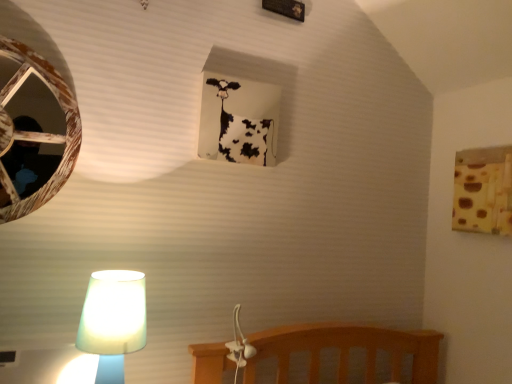
Locate an element on the screen. white paper at upper center, positioned as the 1th window frame in top-to-bottom order is located at coordinates (247, 99).

What do you see at coordinates (113, 321) in the screenshot? The image size is (512, 384). I see `translucent glass lamp at lower left` at bounding box center [113, 321].

I want to click on wooden birdhouse at left, so click(x=33, y=130).

At what (x,y) coordinates should I click in order to perform the action: click on brown textured fabric at upper right, the first window frame positioned from the bottom. Please return your answer as a coordinate pair (x, y). Image resolution: width=512 pixels, height=384 pixels. Looking at the image, I should click on (483, 190).

This screenshot has width=512, height=384. Find the location of `white paper at upper center, the first window frame positioned from the left`. white paper at upper center, the first window frame positioned from the left is located at coordinates pos(247,99).

Is translucent glass lamp at lower left touching wooden birdhouse at left?

translucent glass lamp at lower left is not next to wooden birdhouse at left, and they're not touching.

Can you tell me how much translucent glass lamp at lower left and wooden birdhouse at left differ in facing direction?

The angle between the facing direction of translucent glass lamp at lower left and the facing direction of wooden birdhouse at left is 2.9 degrees.

Would you say translucent glass lamp at lower left is to the left or to the right of wooden birdhouse at left in the picture?

Clearly, translucent glass lamp at lower left is on the right of wooden birdhouse at left in the image.

Is translucent glass lamp at lower left taller or shorter than wooden birdhouse at left?

Considering their sizes, translucent glass lamp at lower left has less height than wooden birdhouse at left.

Considering the points (121, 315) and (268, 103), which point is behind, point (121, 315) or point (268, 103)?

Positioned behind is point (268, 103).

Could you tell me if translucent glass lamp at lower left is turned towards white paper at upper center, the second window frame from the bottom?

No, translucent glass lamp at lower left is not oriented towards white paper at upper center, the second window frame from the bottom.

From the image's perspective, between translucent glass lamp at lower left and white paper at upper center, the first window frame positioned from the left, which one is located above?

white paper at upper center, the first window frame positioned from the left, is shown above in the image.

Would you say translucent glass lamp at lower left is outside white paper at upper center, the first window frame positioned from the left?

Yes, translucent glass lamp at lower left is outside of white paper at upper center, the first window frame positioned from the left.

Considering the positions of objects translucent glass lamp at lower left and brown textured fabric at upper right, which ranks as the 2th window frame in top-to-bottom order, in the image provided, who is more to the right, translucent glass lamp at lower left or brown textured fabric at upper right, which ranks as the 2th window frame in top-to-bottom order,?

Positioned to the right is brown textured fabric at upper right, which ranks as the 2th window frame in top-to-bottom order.

Is translucent glass lamp at lower left inside or outside of brown textured fabric at upper right, the first window frame positioned from the bottom?

translucent glass lamp at lower left lies outside brown textured fabric at upper right, the first window frame positioned from the bottom.

From a real-world perspective, is translucent glass lamp at lower left positioned above or below brown textured fabric at upper right, the 2th window frame from the left?

From a real-world perspective, translucent glass lamp at lower left is physically below brown textured fabric at upper right, the 2th window frame from the left.

Identify the location of lamp that appears below the brown textured fabric at upper right, the 2th window frame from the left (from the image's perspective). The height and width of the screenshot is (384, 512). (113, 321).

Is wooden birdhouse at left bigger or smaller than white paper at upper center, the second window frame from the right?

wooden birdhouse at left is bigger than white paper at upper center, the second window frame from the right.

Does wooden birdhouse at left appear on the right side of white paper at upper center, positioned as the 1th window frame in top-to-bottom order?

No.

Does point (12, 192) come in front of point (237, 61)?

That is True.

Can you confirm if brown textured fabric at upper right, which ranks as the 2th window frame in top-to-bottom order, is wider than white paper at upper center, positioned as the 1th window frame in top-to-bottom order?

In fact, brown textured fabric at upper right, which ranks as the 2th window frame in top-to-bottom order, might be narrower than white paper at upper center, positioned as the 1th window frame in top-to-bottom order.

Is brown textured fabric at upper right, the 2th window frame from the left, positioned beyond the bounds of white paper at upper center, the second window frame from the right?

Absolutely, brown textured fabric at upper right, the 2th window frame from the left, is external to white paper at upper center, the second window frame from the right.

Which is more to the right, brown textured fabric at upper right, the first window frame positioned from the bottom, or white paper at upper center, the second window frame from the right?

Positioned to the right is brown textured fabric at upper right, the first window frame positioned from the bottom.

Is brown textured fabric at upper right, which ranks as the 2th window frame in top-to-bottom order, aimed at white paper at upper center, the second window frame from the right?

Yes, brown textured fabric at upper right, which ranks as the 2th window frame in top-to-bottom order, is aimed at white paper at upper center, the second window frame from the right.

Which object is further away from the camera taking this photo, wooden birdhouse at left or translucent glass lamp at lower left?

wooden birdhouse at left is more distant.

The width and height of the screenshot is (512, 384). In order to click on oval on the left of translucent glass lamp at lower left in this screenshot , I will do `click(33, 130)`.

Is wooden birdhouse at left bigger than translucent glass lamp at lower left?

Correct, wooden birdhouse at left is larger in size than translucent glass lamp at lower left.

From a real-world perspective, is wooden birdhouse at left above or below translucent glass lamp at lower left?

From a real-world perspective, wooden birdhouse at left is physically above translucent glass lamp at lower left.

What's the angular difference between white paper at upper center, the second window frame from the bottom, and wooden birdhouse at left's facing directions?

They differ by 0.00488 degrees in their facing directions.

Who is more distant, white paper at upper center, the second window frame from the bottom, or wooden birdhouse at left?

white paper at upper center, the second window frame from the bottom.

From the image's perspective, who appears lower, white paper at upper center, the second window frame from the bottom, or wooden birdhouse at left?

From the image's view, wooden birdhouse at left is below.

Based on the photo, is white paper at upper center, the second window frame from the right, looking in the opposite direction of wooden birdhouse at left?

No, wooden birdhouse at left is not at the back of white paper at upper center, the second window frame from the right.

Locate an element on the screen. oval behind the translucent glass lamp at lower left is located at coordinates (33, 130).

Where is `lamp below the white paper at upper center, the first window frame positioned from the left (from the image's perspective)`? The height and width of the screenshot is (384, 512). lamp below the white paper at upper center, the first window frame positioned from the left (from the image's perspective) is located at coordinates click(113, 321).

Estimate the real-world distances between objects in this image. Which object is further from wooden birdhouse at left, brown textured fabric at upper right, which ranks as the 2th window frame in top-to-bottom order, or translucent glass lamp at lower left?

brown textured fabric at upper right, which ranks as the 2th window frame in top-to-bottom order, is further to wooden birdhouse at left.

Which object lies nearer to the anchor point translucent glass lamp at lower left, brown textured fabric at upper right, the 2th window frame from the left, or wooden birdhouse at left?

wooden birdhouse at left lies closer to translucent glass lamp at lower left than the other object.

Estimate the real-world distances between objects in this image. Which object is closer to brown textured fabric at upper right, acting as the 1th window frame starting from the right, white paper at upper center, the second window frame from the right, or translucent glass lamp at lower left?

white paper at upper center, the second window frame from the right, lies closer to brown textured fabric at upper right, acting as the 1th window frame starting from the right, than the other object.

Based on their spatial positions, is wooden birdhouse at left or white paper at upper center, positioned as the 1th window frame in top-to-bottom order, further from brown textured fabric at upper right, which ranks as the 2th window frame in top-to-bottom order?

Among the two, wooden birdhouse at left is located further to brown textured fabric at upper right, which ranks as the 2th window frame in top-to-bottom order.

Based on the photo, considering their positions, is wooden birdhouse at left positioned further to translucent glass lamp at lower left than white paper at upper center, the first window frame positioned from the left?

The object further to translucent glass lamp at lower left is white paper at upper center, the first window frame positioned from the left.

Estimate the real-world distances between objects in this image. Which object is closer to white paper at upper center, the first window frame positioned from the left, brown textured fabric at upper right, acting as the 1th window frame starting from the right, or translucent glass lamp at lower left?

Among the two, translucent glass lamp at lower left is located nearer to white paper at upper center, the first window frame positioned from the left.

Which object lies further to the anchor point brown textured fabric at upper right, the 2th window frame from the left, white paper at upper center, the second window frame from the bottom, or wooden birdhouse at left?

wooden birdhouse at left lies further to brown textured fabric at upper right, the 2th window frame from the left, than the other object.

From the image, which object appears to be farther from white paper at upper center, the first window frame positioned from the left, translucent glass lamp at lower left or wooden birdhouse at left?

translucent glass lamp at lower left.

Find the location of `window frame between wooden birdhouse at left and brown textured fabric at upper right, which ranks as the 2th window frame in top-to-bottom order, in the horizontal direction`. window frame between wooden birdhouse at left and brown textured fabric at upper right, which ranks as the 2th window frame in top-to-bottom order, in the horizontal direction is located at coordinates (247, 99).

The height and width of the screenshot is (384, 512). In order to click on lamp between wooden birdhouse at left and brown textured fabric at upper right, which ranks as the 2th window frame in top-to-bottom order in this screenshot , I will do `click(113, 321)`.

Locate an element on the screen. The height and width of the screenshot is (384, 512). oval that lies between white paper at upper center, the second window frame from the bottom, and translucent glass lamp at lower left from top to bottom is located at coordinates (33, 130).

You are a GUI agent. You are given a task and a screenshot of the screen. Output one action in this format:
    pyautogui.click(x=<x>, y=<y>)
    Task: Click on the window frame located between translucent glass lamp at lower left and brown textured fabric at upper right, the 2th window frame from the left, in the left-right direction
    
    Given the screenshot: What is the action you would take?
    pyautogui.click(x=247, y=99)